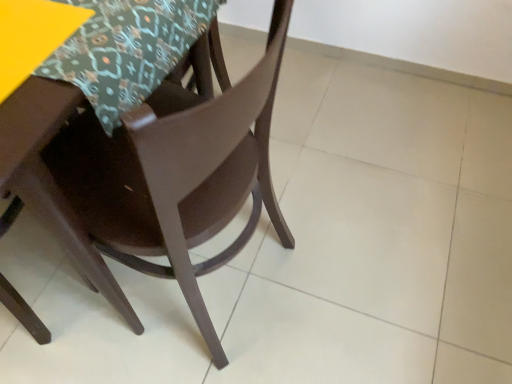
This screenshot has width=512, height=384. What do you see at coordinates (32, 36) in the screenshot?
I see `yellow matte table at upper left` at bounding box center [32, 36].

At what (x,y) coordinates should I click in order to perform the action: click on yellow matte table at upper left. Please return your answer as a coordinate pair (x, y). This screenshot has width=512, height=384. Looking at the image, I should click on pos(32,36).

From the image's perspective, is matte brown chair at center above yellow matte table at upper left?

No, from the image's perspective, matte brown chair at center is not over yellow matte table at upper left.

How many degrees apart are the facing directions of matte brown chair at center and yellow matte table at upper left?

96.5 degrees.

Between matte brown chair at center and yellow matte table at upper left, which one has smaller width?

With smaller width is yellow matte table at upper left.

Which is in front, point (22, 42) or point (214, 3)?

The point (22, 42) is closer.

Can you see yellow matte table at upper left touching patterned fabric tablecloth at upper left?

Yes, yellow matte table at upper left is next to patterned fabric tablecloth at upper left.

What's the angular difference between yellow matte table at upper left and patterned fabric tablecloth at upper left's facing directions?

0.186 degrees.

Which is in front, yellow matte table at upper left or patterned fabric tablecloth at upper left?

yellow matte table at upper left is in front.

The width and height of the screenshot is (512, 384). Identify the location of chair below the patterned fabric tablecloth at upper left (from a real-world perspective). (148, 173).

How different are the orientations of patterned fabric tablecloth at upper left and matte brown chair at center in degrees?

The angle between the facing direction of patterned fabric tablecloth at upper left and the facing direction of matte brown chair at center is 96.3 degrees.

Which of these two, patterned fabric tablecloth at upper left or matte brown chair at center, is bigger?

matte brown chair at center.

Is patterned fabric tablecloth at upper left positioned in front of matte brown chair at center?

No, patterned fabric tablecloth at upper left is further to the viewer.

From the picture: From a real-world perspective, between yellow matte table at upper left and matte brown chair at center, who is vertically higher?

yellow matte table at upper left is physically above.

Which object is thinner, yellow matte table at upper left or matte brown chair at center?

yellow matte table at upper left is thinner.

Is yellow matte table at upper left positioned far away from matte brown chair at center?

That's not correct — yellow matte table at upper left is a little close to matte brown chair at center.

Is yellow matte table at upper left aimed at matte brown chair at center?

Yes, yellow matte table at upper left is oriented towards matte brown chair at center.

Can we say matte brown chair at center lies outside patterned fabric tablecloth at upper left?

Yes, matte brown chair at center is not within patterned fabric tablecloth at upper left.

From the image's perspective, is matte brown chair at center located above or below patterned fabric tablecloth at upper left?

Based on their image positions, matte brown chair at center is located beneath patterned fabric tablecloth at upper left.

In the scene shown: Considering the relative sizes of matte brown chair at center and patterned fabric tablecloth at upper left in the image provided, is matte brown chair at center thinner than patterned fabric tablecloth at upper left?

Incorrect, the width of matte brown chair at center is not less than that of patterned fabric tablecloth at upper left.

Does patterned fabric tablecloth at upper left touch yellow matte table at upper left?

Absolutely, patterned fabric tablecloth at upper left is next to and touching yellow matte table at upper left.

Is point (108, 109) closer or farther from the camera than point (54, 10)?

Point (108, 109).

From the image's perspective, which object appears higher, patterned fabric tablecloth at upper left or yellow matte table at upper left?

patterned fabric tablecloth at upper left, from the image's perspective.

From a real-world perspective, is patterned fabric tablecloth at upper left physically above yellow matte table at upper left?

No, from a real-world perspective, patterned fabric tablecloth at upper left is not on top of yellow matte table at upper left.

Find the location of a particular element. The height and width of the screenshot is (384, 512). table that appears behind the matte brown chair at center is located at coordinates pos(32,36).

Locate an element on the screen. This screenshot has height=384, width=512. tablecloth lying on the right of yellow matte table at upper left is located at coordinates (127, 50).

When comparing their distances from matte brown chair at center, does yellow matte table at upper left or patterned fabric tablecloth at upper left seem closer?

Based on the image, patterned fabric tablecloth at upper left appears to be nearer to matte brown chair at center.

Which object lies nearer to the anchor point patterned fabric tablecloth at upper left, matte brown chair at center or yellow matte table at upper left?

yellow matte table at upper left lies closer to patterned fabric tablecloth at upper left than the other object.

Based on their spatial positions, is matte brown chair at center or patterned fabric tablecloth at upper left further from yellow matte table at upper left?

Among the two, matte brown chair at center is located further to yellow matte table at upper left.

Looking at the image, which one is located further to yellow matte table at upper left, patterned fabric tablecloth at upper left or matte brown chair at center?

Among the two, matte brown chair at center is located further to yellow matte table at upper left.

From the image, which object appears to be farther from patterned fabric tablecloth at upper left, yellow matte table at upper left or matte brown chair at center?

matte brown chair at center is further to patterned fabric tablecloth at upper left.

Estimate the real-world distances between objects in this image. Which object is further from matte brown chair at center, patterned fabric tablecloth at upper left or yellow matte table at upper left?

yellow matte table at upper left is positioned further to the anchor matte brown chair at center.

Identify the location of tablecloth between yellow matte table at upper left and matte brown chair at center from left to right. This screenshot has height=384, width=512. (127, 50).